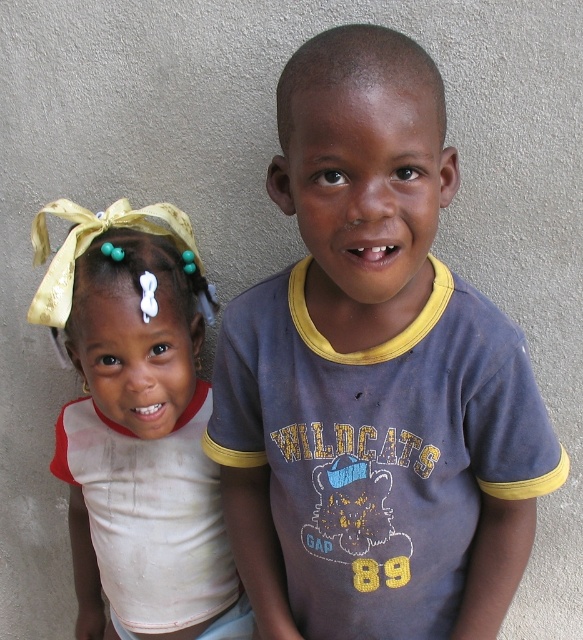
Question: From the image, what is the correct spatial relationship of dark blue t-shirt at center in relation to white fabric headband at left?

Choices:
 (A) right
 (B) left

Answer: (A)

Question: Among these points, which one is farthest from the camera?

Choices:
 (A) (149, 220)
 (B) (408, 230)

Answer: (A)

Question: Is dark blue t-shirt at center above white fabric headband at left?

Choices:
 (A) yes
 (B) no

Answer: (A)

Question: Which point is closer to the camera?

Choices:
 (A) white fabric headband at left
 (B) dark blue t-shirt at center

Answer: (B)

Question: Does dark blue t-shirt at center have a greater width compared to white fabric headband at left?

Choices:
 (A) yes
 (B) no

Answer: (A)